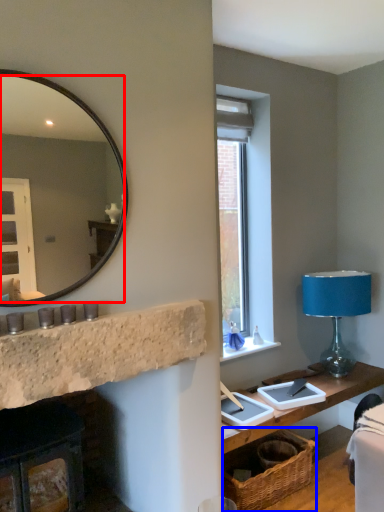
Question: Which point is further to the camera, mirror (highlighted by a red box) or basket (highlighted by a blue box)?

Choices:
 (A) mirror
 (B) basket

Answer: (B)